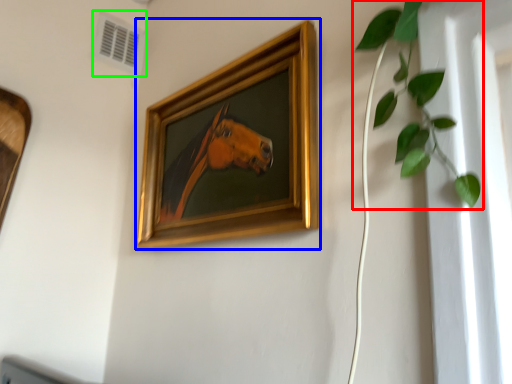
Question: Estimate the real-world distances between objects in this image. Which object is closer to houseplant (highlighted by a red box), picture frame (highlighted by a blue box) or air conditioning (highlighted by a green box)?

Choices:
 (A) picture frame
 (B) air conditioning

Answer: (A)